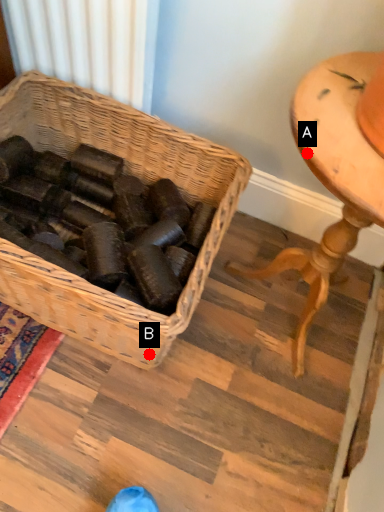
Question: Two points are circled on the image, labeled by A and B beside each circle. Which point is closer to the camera?

Choices:
 (A) A is closer
 (B) B is closer

Answer: (A)